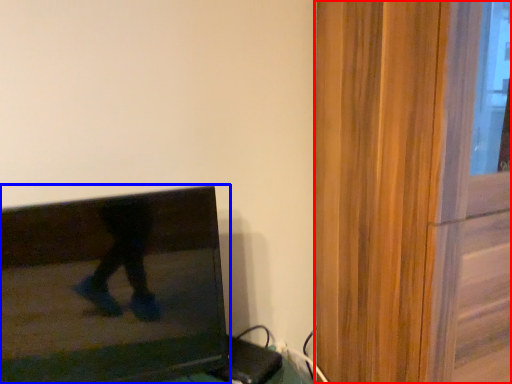
Question: Which object is closer to the camera taking this photo, screen door (highlighted by a red box) or television (highlighted by a blue box)?

Choices:
 (A) screen door
 (B) television

Answer: (A)